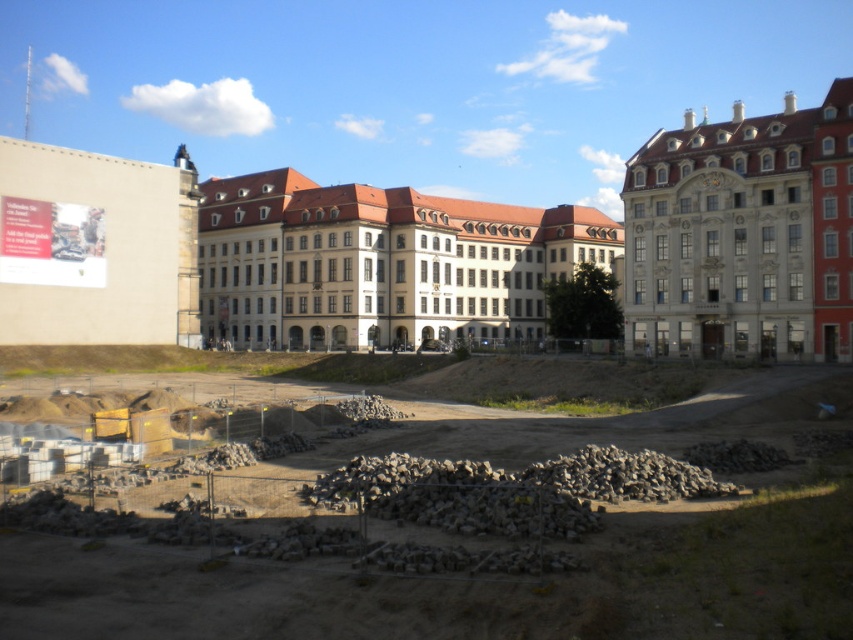
Question: Considering the relative positions of white stone building at center and white stone building at upper right in the image provided, where is white stone building at center located with respect to white stone building at upper right?

Choices:
 (A) left
 (B) right

Answer: (A)

Question: Can you confirm if gray gravel pile at center is bigger than white stone building at center?

Choices:
 (A) yes
 (B) no

Answer: (B)

Question: Which point is closer to the camera?

Choices:
 (A) gray gravel pile at center
 (B) white stone building at center

Answer: (A)

Question: Does gray gravel pile at center appear on the right side of white stone building at center?

Choices:
 (A) yes
 (B) no

Answer: (A)

Question: Which object is closer to the camera taking this photo?

Choices:
 (A) white stone building at center
 (B) white stone building at upper right
 (C) gray gravel pile at center

Answer: (C)

Question: Which point appears closest to the camera in this image?

Choices:
 (A) (729, 392)
 (B) (759, 352)
 (C) (460, 250)

Answer: (A)